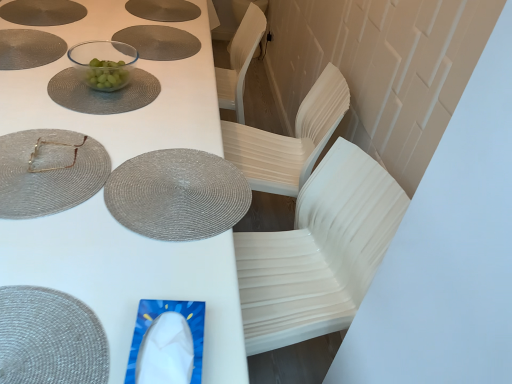
Locate an element on the screen. The image size is (512, 384). vacant space behind matte gray placemat at upper center, which appears as the 2th plate when viewed from the left is located at coordinates (183, 13).